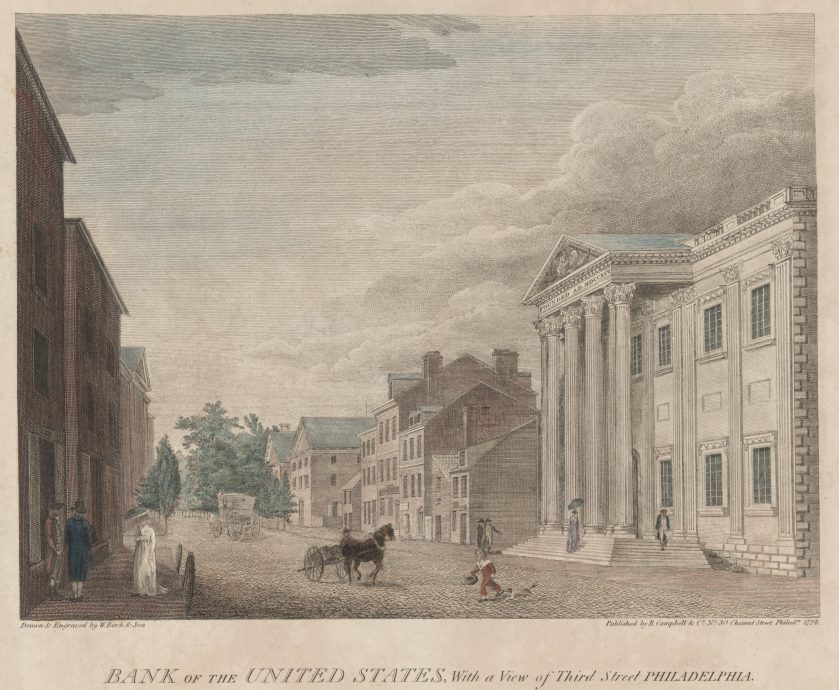
I want to click on pillar, so click(553, 388), click(570, 420), click(593, 390), click(626, 404).